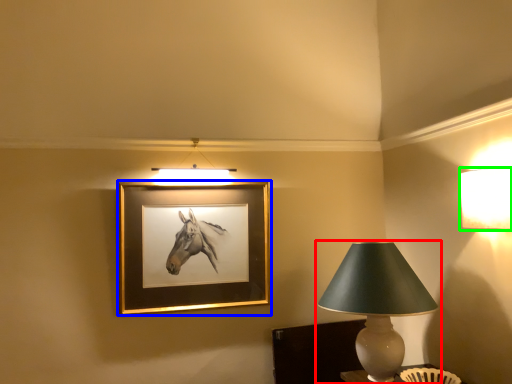
Question: Which is farther away from lamp (highlighted by a red box)? picture frame (highlighted by a blue box) or lamp (highlighted by a green box)?

Choices:
 (A) picture frame
 (B) lamp

Answer: (A)